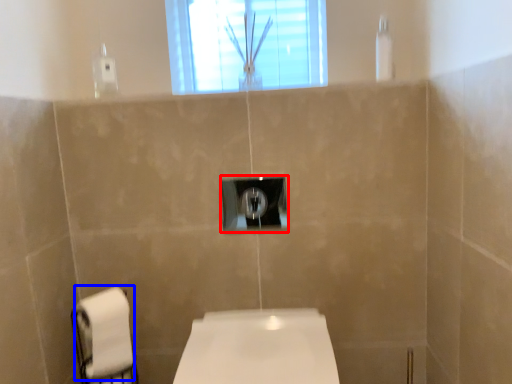
Question: Which object appears farthest to the camera in this image, light switch (highlighted by a red box) or toilet paper (highlighted by a blue box)?

Choices:
 (A) light switch
 (B) toilet paper

Answer: (A)